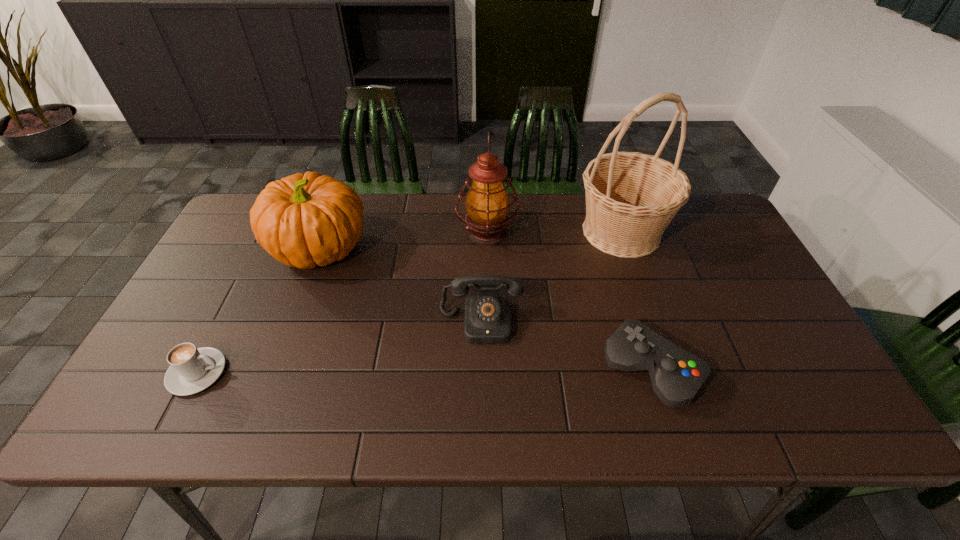
Locate an element on the screen. Image resolution: width=960 pixels, height=540 pixels. object at the near left corner is located at coordinates (192, 369).

The width and height of the screenshot is (960, 540). Find the location of `vacant area at the far edge`. vacant area at the far edge is located at coordinates (399, 202).

In the image, there is a desktop. Where is `vacant region at the near edge`? vacant region at the near edge is located at coordinates tap(579, 394).

At what (x,y) coordinates should I click in order to perform the action: click on vacant space at the right edge of the desktop. Please return your answer as a coordinate pair (x, y). Image resolution: width=960 pixels, height=540 pixels. Looking at the image, I should click on (722, 245).

This screenshot has width=960, height=540. In the image, there is a desktop. Identify the location of vacant area at the far left corner. (243, 238).

Where is `empty location between the fourth tallest object and the fourth shortest object`? The height and width of the screenshot is (540, 960). empty location between the fourth tallest object and the fourth shortest object is located at coordinates (401, 285).

Where is `vacant region between the oil lamp and the pumpkin`? vacant region between the oil lamp and the pumpkin is located at coordinates (404, 240).

Where is `free space between the cappuccino and the tallest object`? The image size is (960, 540). free space between the cappuccino and the tallest object is located at coordinates (409, 302).

This screenshot has width=960, height=540. In order to click on free space between the telephone and the basket in this screenshot , I will do click(551, 277).

Find the location of a particular element. The width and height of the screenshot is (960, 540). free point between the telephone and the tallest object is located at coordinates (551, 277).